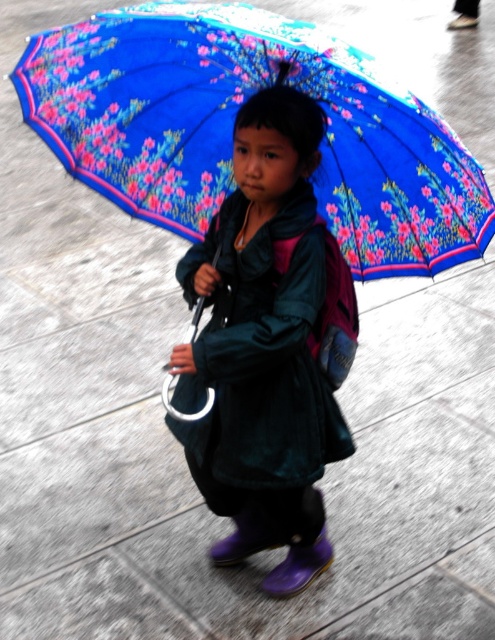
Based on the photo, between blue floral-patterned umbrella at upper center and velvet green coat at center, which one appears on the right side from the viewer's perspective?

From the viewer's perspective, blue floral-patterned umbrella at upper center appears more on the right side.

Is blue floral-patterned umbrella at upper center to the right of velvet green coat at center from the viewer's perspective?

Yes, blue floral-patterned umbrella at upper center is to the right of velvet green coat at center.

What do you see at coordinates (232, 128) in the screenshot?
I see `blue floral-patterned umbrella at upper center` at bounding box center [232, 128].

Locate an element on the screen. This screenshot has height=640, width=495. blue floral-patterned umbrella at upper center is located at coordinates (232, 128).